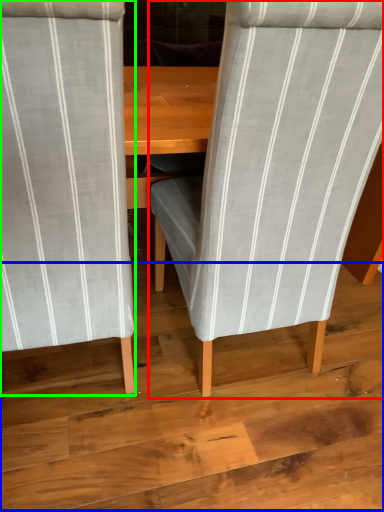
Question: Based on their relative distances, which object is farther from chair (highlighted by a red box)? Choose from plywood (highlighted by a blue box) and chair (highlighted by a green box).

Choices:
 (A) plywood
 (B) chair

Answer: (A)